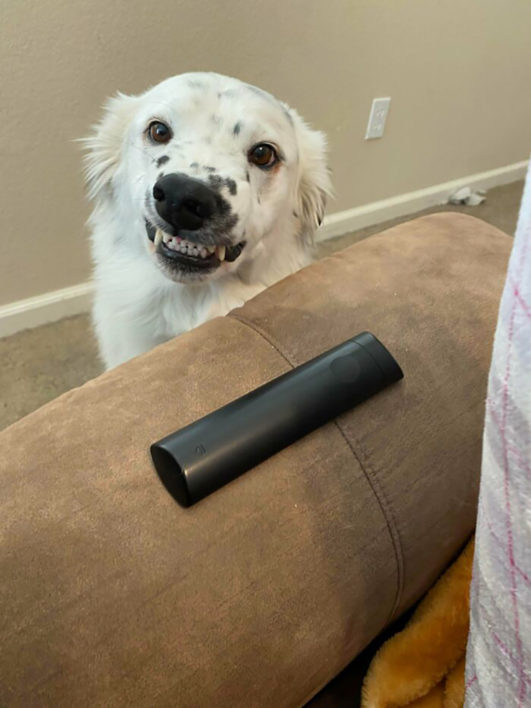
I want to click on remote, so click(x=245, y=432).